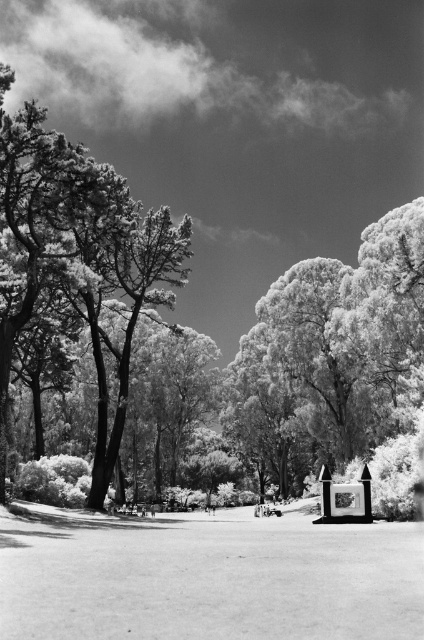
Question: Which of the following is the closest to the observer?

Choices:
 (A) smooth white tree at left
 (B) smooth bark tree at center

Answer: (A)

Question: In this image, where is smooth bark tree at center located relative to smooth white tree at left?

Choices:
 (A) below
 (B) above

Answer: (B)

Question: Does smooth bark tree at center have a smaller size compared to smooth white tree at left?

Choices:
 (A) yes
 (B) no

Answer: (B)

Question: Can you confirm if smooth bark tree at center is thinner than smooth white tree at left?

Choices:
 (A) yes
 (B) no

Answer: (B)